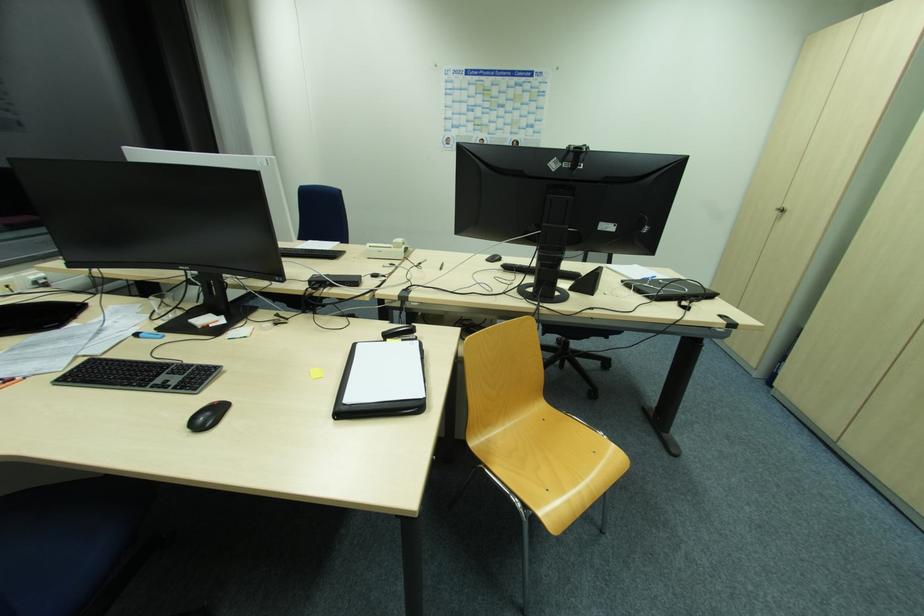
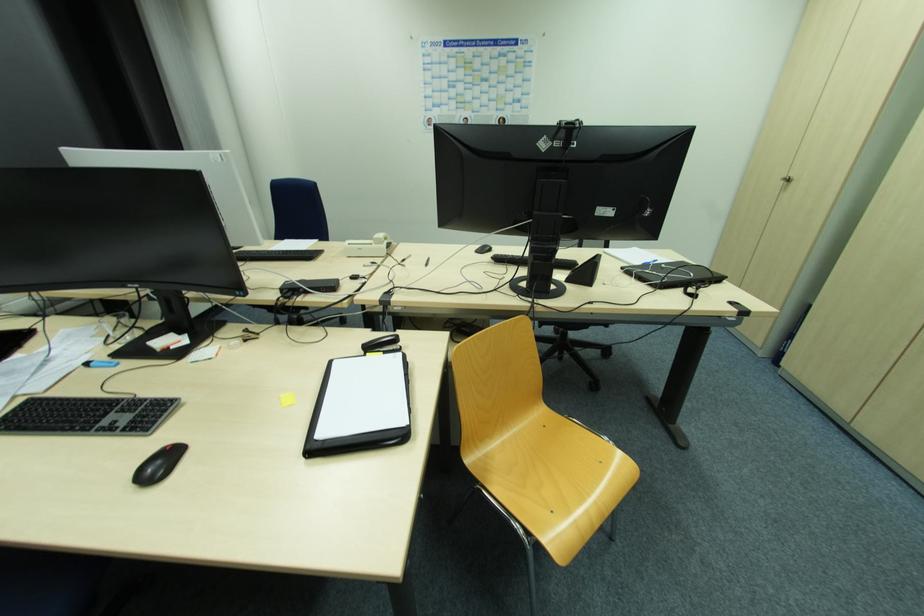
Question: The images are taken continuously from a first-person perspective. In which direction are you moving?

Choices:
 (A) Left
 (B) Right
 (C) Forward
 (D) Backward

Answer: (C)